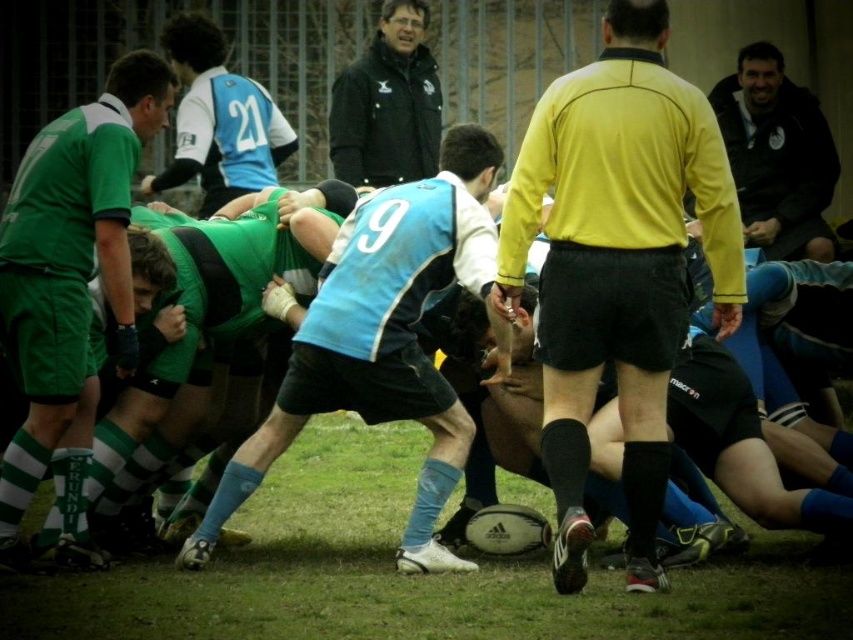
Does blue matte jersey at center have a greater width compared to black leather jacket at upper right?

Correct, the width of blue matte jersey at center exceeds that of black leather jacket at upper right.

Can you confirm if blue matte jersey at center is positioned to the right of black leather jacket at upper right?

No, blue matte jersey at center is not to the right of black leather jacket at upper right.

Which is behind, point (280, 442) or point (817, 138)?

The point (817, 138) is behind.

Image resolution: width=853 pixels, height=640 pixels. Identify the location of blue matte jersey at center. [x=381, y=339].

Who is more distant from viewer, (398, 310) or (405, 20)?

The point (405, 20) is more distant.

Can you confirm if blue matte jersey at center is positioned below black jacket at upper center?

Yes, blue matte jersey at center is below black jacket at upper center.

Does point (428, 403) lie in front of point (396, 83)?

Yes, it is.

The width and height of the screenshot is (853, 640). I want to click on blue matte jersey at center, so click(x=381, y=339).

Who is more forward, (134, 147) or (422, 54)?

Positioned in front is point (134, 147).

Who is positioned more to the right, green matte shorts at left or black jacket at upper center?

From the viewer's perspective, black jacket at upper center appears more on the right side.

Is point (64, 266) less distant than point (415, 74)?

That is True.

Identify the location of green matte shorts at left. The width and height of the screenshot is (853, 640). (70, 276).